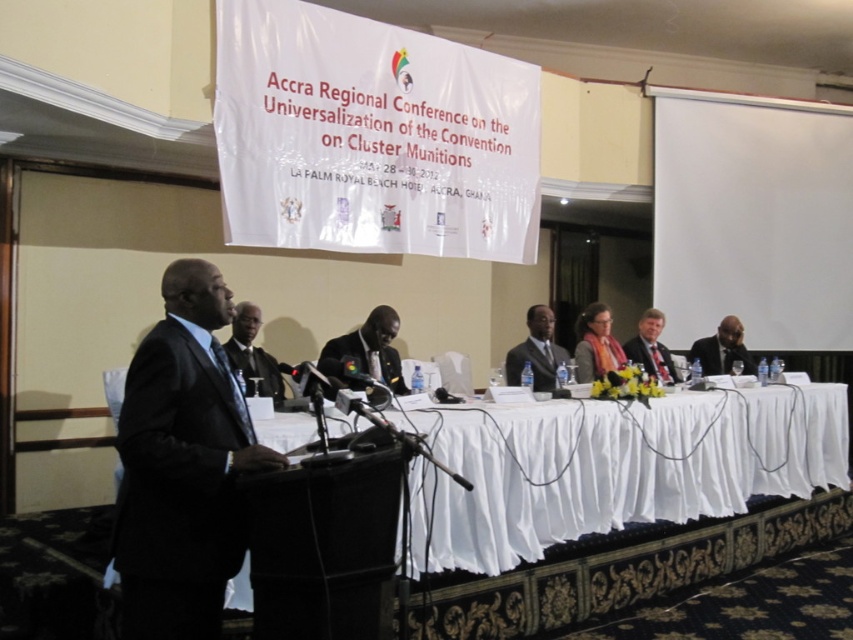
Question: Which point is closer to the camera taking this photo?

Choices:
 (A) (589, 371)
 (B) (535, 364)
 (C) (485, 465)

Answer: (C)

Question: Is black matte suit at center below black matte suit at right?

Choices:
 (A) yes
 (B) no

Answer: (A)

Question: Does white cloth-covered table at center have a lesser width compared to matte pink scarf at center?

Choices:
 (A) yes
 (B) no

Answer: (B)

Question: Among these points, which one is nearest to the camera?

Choices:
 (A) (717, 355)
 (B) (445, 506)
 (C) (254, 348)
 (D) (670, 356)

Answer: (B)

Question: Among these points, which one is farthest from the camera?

Choices:
 (A) tap(654, 342)
 (B) tap(602, 362)
 (C) tap(352, 381)
 (D) tap(251, 358)

Answer: (A)

Question: Is matte pink scarf at center to the left of black matte suit at right from the viewer's perspective?

Choices:
 (A) no
 (B) yes

Answer: (B)